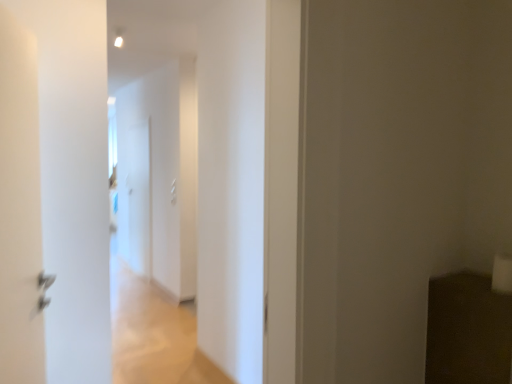
What do you see at coordinates (139, 198) in the screenshot? This screenshot has height=384, width=512. I see `white glossy door at center` at bounding box center [139, 198].

Where is `white glossy door at center`? The height and width of the screenshot is (384, 512). white glossy door at center is located at coordinates (139, 198).

Where is `white glossy door at center`? white glossy door at center is located at coordinates (139, 198).